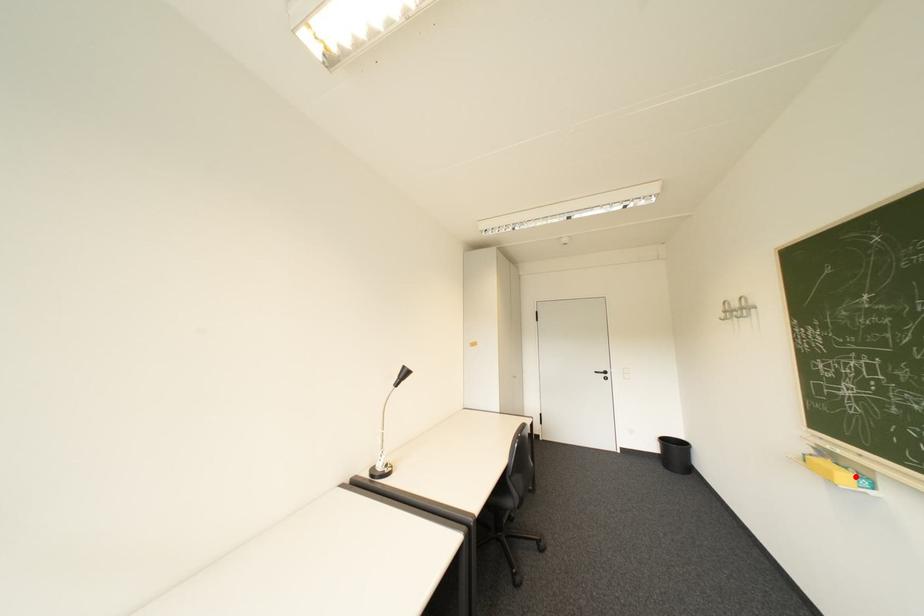
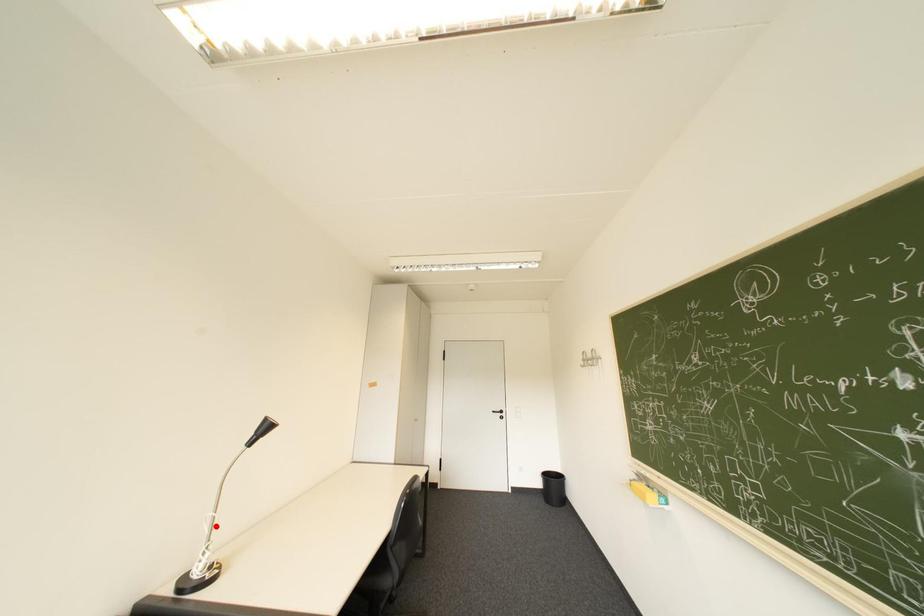
I am providing you with two images of the same scene from different viewpoints. A red point is marked on the first image and another point is marked on the second image. Does the point marked in image1 correspond to the same location as the one in image2?

No